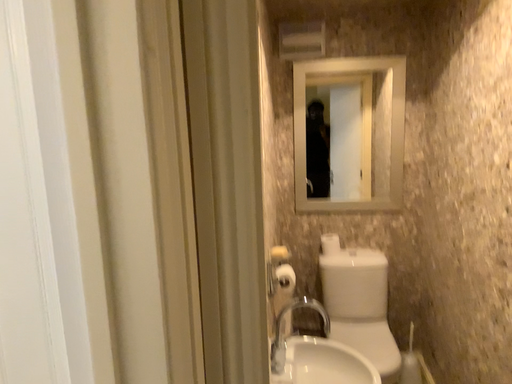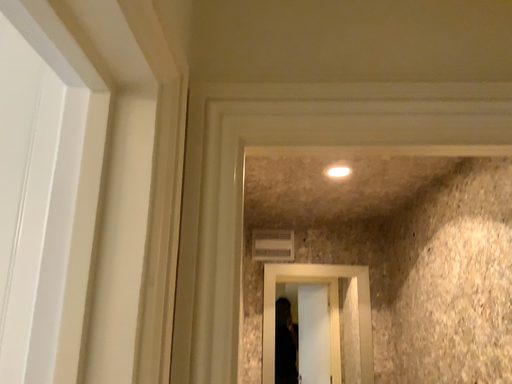
Question: Which way did the camera rotate in the video?

Choices:
 (A) rotated downward
 (B) rotated upward

Answer: (B)